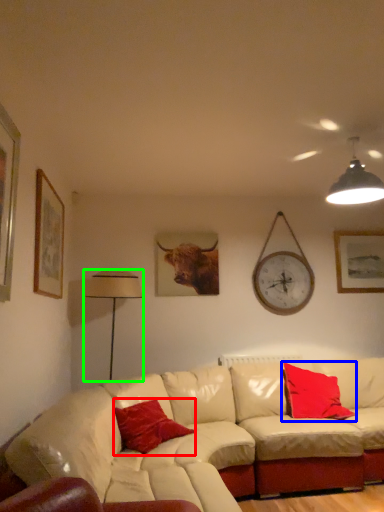
Question: Considering the real-world distances, which object is farthest from pillow (highlighted by a red box)? pillow (highlighted by a blue box) or table lamp (highlighted by a green box)?

Choices:
 (A) pillow
 (B) table lamp

Answer: (A)